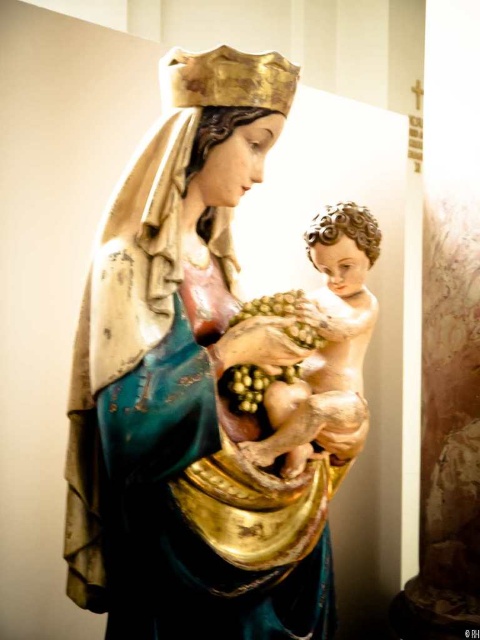
Between matte gold statue at center and smooth wooden baby at center, which one has less height?

Standing shorter between the two is smooth wooden baby at center.

Does point (152, 170) lie behind point (312, 371)?

No, (152, 170) is in front of (312, 371).

Between point (208, 280) and point (304, 422), which one is positioned behind?

The point (208, 280) is behind.

Locate an element on the screen. The image size is (480, 640). matte gold statue at center is located at coordinates (191, 388).